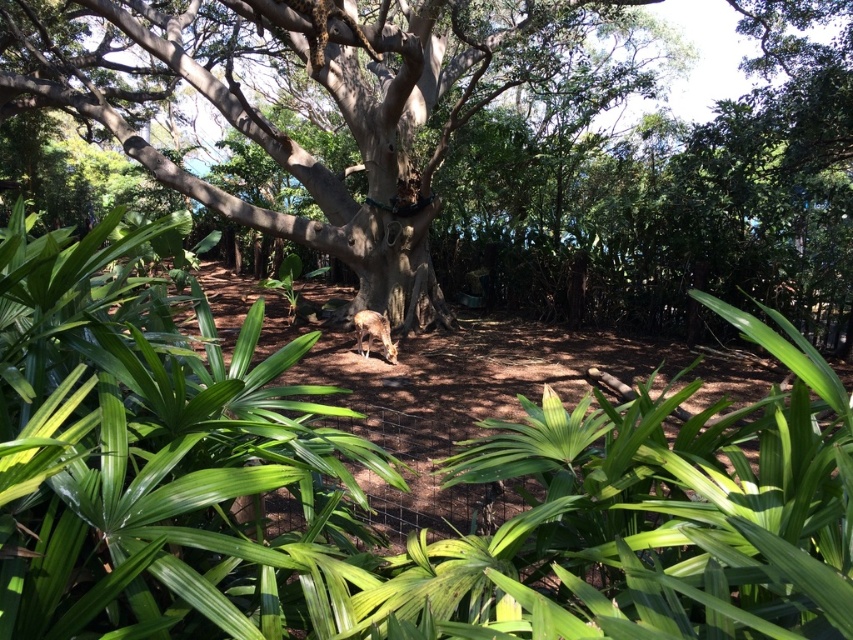
You are a visitor at the zoo and want to take a photo of the smooth bark tree at center without any obstruction. However, there is a green leafy plant at center in the way. Can you move the plant to the side to get a clear view of the tree?

The green leafy plant at center is in front of the smooth bark tree at center, so moving it to the side would allow you to see the tree without obstruction.